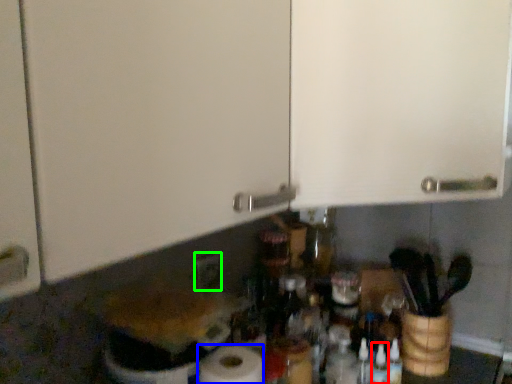
Question: Based on their relative distances, which object is farther from bottle (highlighted by a red box)? Choose from paper towel (highlighted by a blue box) and electric outlet (highlighted by a green box).

Choices:
 (A) paper towel
 (B) electric outlet

Answer: (B)